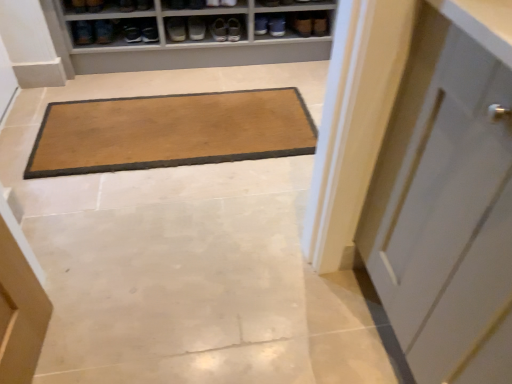
Question: In terms of height, does matte black shoe at upper center, arranged as the 4th shoe when viewed from the left, look taller or shorter compared to matte gray shoe at upper center, which ranks as the first footwear in right-to-left order?

Choices:
 (A) tall
 (B) short

Answer: (A)

Question: From a real-world perspective, is matte black shoe at upper center, which ranks as the second shoe in right-to-left order, above or below matte gray shoe at upper center, positioned as the 5th footwear in left-to-right order?

Choices:
 (A) below
 (B) above

Answer: (B)

Question: Estimate the real-world distances between objects in this image. Which object is farther from the matte black shoe at upper left, which is the third footwear in right-to-left order?

Choices:
 (A) matte brown shoe at upper center, the fourth footwear viewed from the left
 (B) matte black shoe at upper left, which is the 5th footwear from right to left
 (C) brown suede shoe at upper left, which ranks as the fifth shoe in right-to-left order
 (D) matte brown shoe at upper center, the third shoe viewed from the left
 (E) matte gray shoe at upper center, positioned as the 5th footwear in left-to-right order

Answer: (E)

Question: Which object is positioned farthest from the matte brown shoe at upper center, the third shoe viewed from the left?

Choices:
 (A) matte brown shoe at upper center, the 2th footwear positioned from the right
 (B) matte black shoe at upper center, arranged as the 4th shoe when viewed from the left
 (C) brown suede shoe at upper left, the second shoe viewed from the left
 (D) brown suede shoe at upper center, which ranks as the first shoe in right-to-left order
 (E) matte black shoe at upper left, which is counted as the third footwear, starting from the left

Answer: (D)